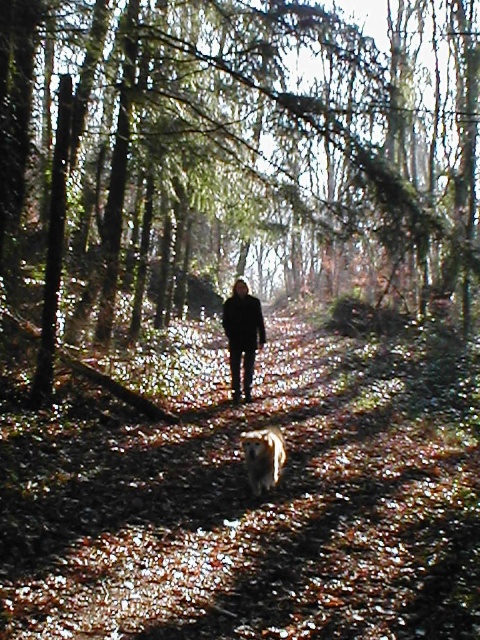
Can you confirm if green leafy tree at center is positioned below brown leafy forest path at center?

Actually, green leafy tree at center is above brown leafy forest path at center.

Describe the element at coordinates (237, 157) in the screenshot. I see `green leafy tree at center` at that location.

In order to click on green leafy tree at center in this screenshot , I will do 237,157.

You are a GUI agent. You are given a task and a screenshot of the screen. Output one action in this format:
    pyautogui.click(x=<x>, y=<y>)
    Task: Click on the green leafy tree at center
    The height and width of the screenshot is (640, 480).
    Given the screenshot: What is the action you would take?
    [237, 157]

Between green leafy tree at center and dark matte coat at center, which one is positioned lower?

dark matte coat at center

Is point (348, 173) in front of point (259, 323)?

No, (348, 173) is further to viewer.

At what (x,y) coordinates should I click in order to perform the action: click on green leafy tree at center. Please return your answer as a coordinate pair (x, y). Image resolution: width=480 pixels, height=640 pixels. Looking at the image, I should click on (237, 157).

Looking at this image, can you confirm if dark matte coat at center is smaller than golden fur dog at center?

Yes.

The width and height of the screenshot is (480, 640). I want to click on dark matte coat at center, so pos(242,333).